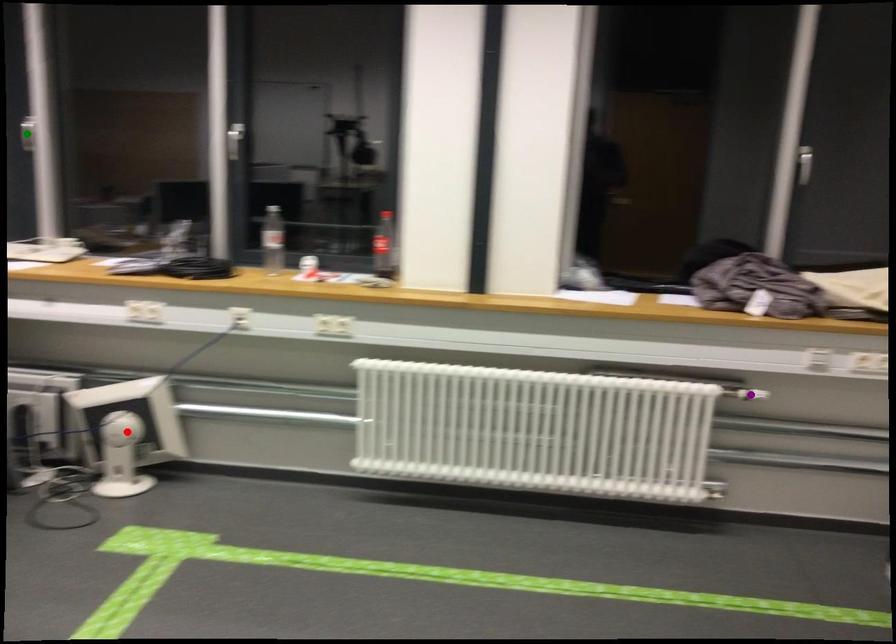
Order these from nearest to farthest:
green point | purple point | red point

1. purple point
2. red point
3. green point